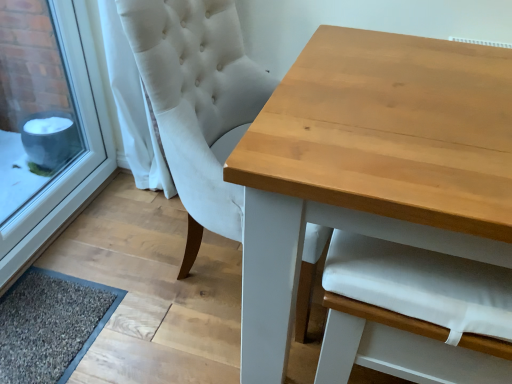
Question: Can you confirm if light brown wooden table at center is thinner than white plastic window frame at lower left?

Choices:
 (A) yes
 (B) no

Answer: (B)

Question: Considering the relative sizes of light brown wooden table at center and white plastic window frame at lower left in the image provided, is light brown wooden table at center wider than white plastic window frame at lower left?

Choices:
 (A) yes
 (B) no

Answer: (A)

Question: From a real-world perspective, is light brown wooden table at center located beneath white plastic window frame at lower left?

Choices:
 (A) yes
 (B) no

Answer: (A)

Question: Does light brown wooden table at center turn towards white plastic window frame at lower left?

Choices:
 (A) yes
 (B) no

Answer: (B)

Question: Considering the relative positions of light brown wooden table at center and white plastic window frame at lower left in the image provided, is light brown wooden table at center to the right of white plastic window frame at lower left from the viewer's perspective?

Choices:
 (A) yes
 (B) no

Answer: (A)

Question: Is white plastic window frame at lower left at the back of light brown wooden table at center?

Choices:
 (A) no
 (B) yes

Answer: (A)

Question: Does light brown wooden table at center have a larger size compared to dark gray textured mat at lower left?

Choices:
 (A) no
 (B) yes

Answer: (B)

Question: Is light brown wooden table at center closer to the viewer compared to dark gray textured mat at lower left?

Choices:
 (A) no
 (B) yes

Answer: (B)

Question: Is the surface of light brown wooden table at center in direct contact with dark gray textured mat at lower left?

Choices:
 (A) no
 (B) yes

Answer: (A)

Question: From a real-world perspective, does light brown wooden table at center sit lower than dark gray textured mat at lower left?

Choices:
 (A) yes
 (B) no

Answer: (B)

Question: Can you confirm if light brown wooden table at center is positioned to the right of dark gray textured mat at lower left?

Choices:
 (A) yes
 (B) no

Answer: (A)

Question: Is light brown wooden table at center positioned far away from dark gray textured mat at lower left?

Choices:
 (A) yes
 (B) no

Answer: (B)

Question: Is white plastic window frame at lower left far from white fabric chair at upper center?

Choices:
 (A) no
 (B) yes

Answer: (A)